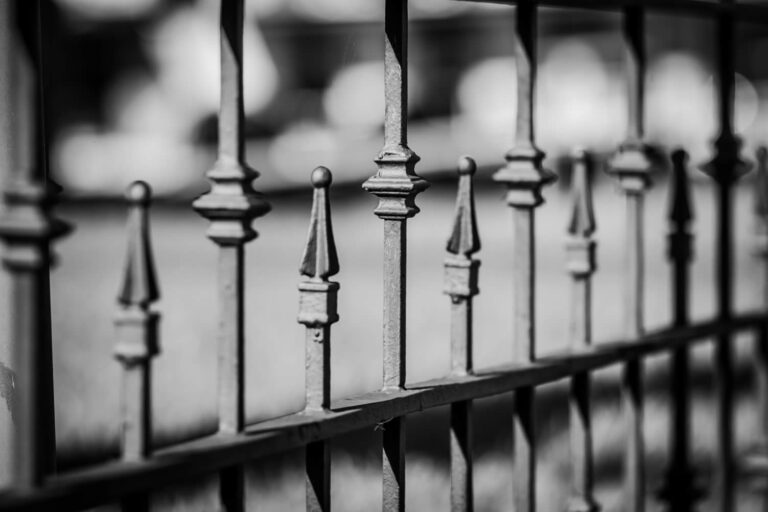
Find the location of `rod`. rod is located at coordinates (232, 377).